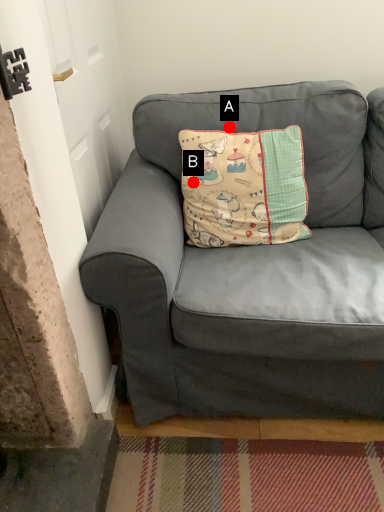
Question: Two points are circled on the image, labeled by A and B beside each circle. Among these points, which one is farthest from the camera?

Choices:
 (A) A is further
 (B) B is further

Answer: (A)